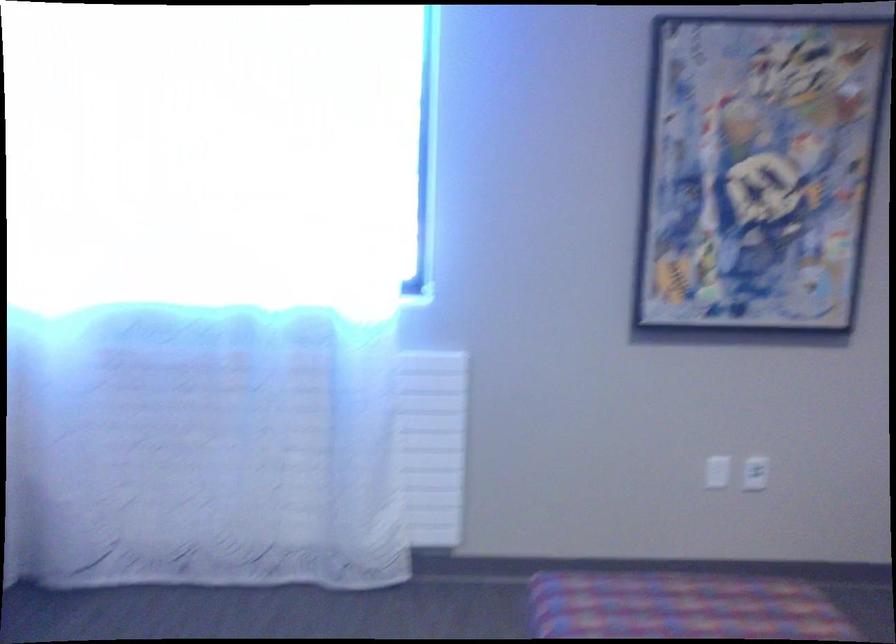
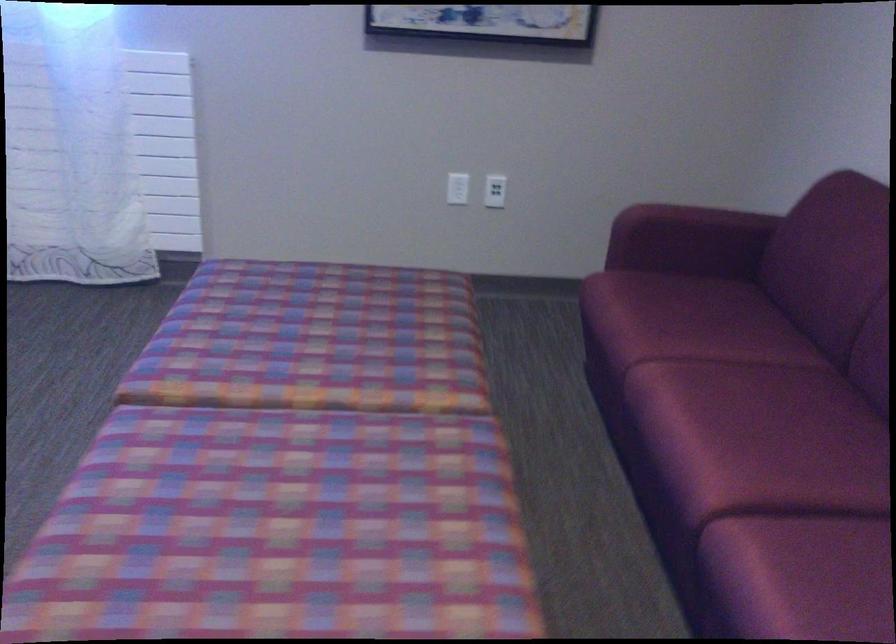
Where in the second image is the point corresponding to the point at 761,476 from the first image?

(495, 191)